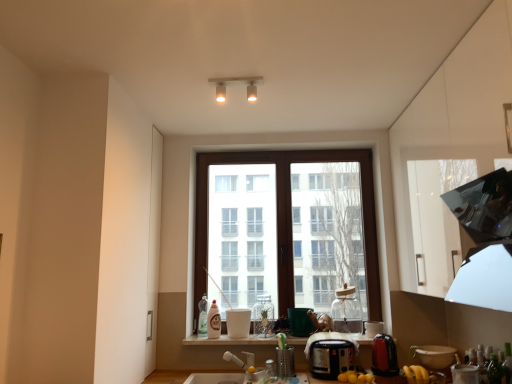
Question: Considering the positions of white glossy bottle at center, which ranks as the 2th bottle in left-to-right order, and matte white light fixture at upper center in the image, is white glossy bottle at center, which ranks as the 2th bottle in left-to-right order, wider or thinner than matte white light fixture at upper center?

Choices:
 (A) wide
 (B) thin

Answer: (A)

Question: From the image's perspective, is white glossy bottle at center, the third bottle from the front, positioned above or below matte white light fixture at upper center?

Choices:
 (A) above
 (B) below

Answer: (B)

Question: Which is nearer to the brown wooden window at center?

Choices:
 (A) white glossy window sill at lower center
 (B) matte white bowl at lower right, acting as the 1th appliance starting from the right
 (C) matte black kettle at lower right, positioned as the 5th appliance in left-to-right order
 (D) white glossy cup at center, which appears as the 1th appliance when viewed from the left
 (E) clear glass jar at center, the third bottle when ordered from back to front

Answer: (E)

Question: Which is farther from the green glass bottle at lower right, marked as the 4th bottle in a left-to-right arrangement?

Choices:
 (A) matte black kettle at lower right, positioned as the 5th appliance in left-to-right order
 (B) white glossy cup at center, which appears as the 1th appliance when viewed from the left
 (C) black plastic toaster at center, the 4th appliance viewed from the right
 (D) white glossy bottle at center, which is the second bottle in back-to-front order
 (E) matte white light fixture at upper center

Answer: (E)